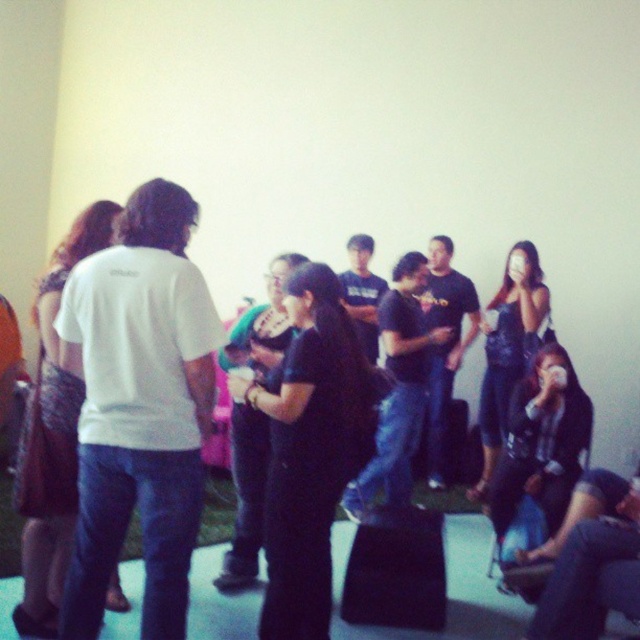
Which is above, white matte t-shirt at left or black matte shirt at center?

white matte t-shirt at left is above.

Which is behind, point (120, 280) or point (339, 442)?

Positioned behind is point (339, 442).

Image resolution: width=640 pixels, height=640 pixels. I want to click on white matte t-shirt at left, so click(x=140, y=406).